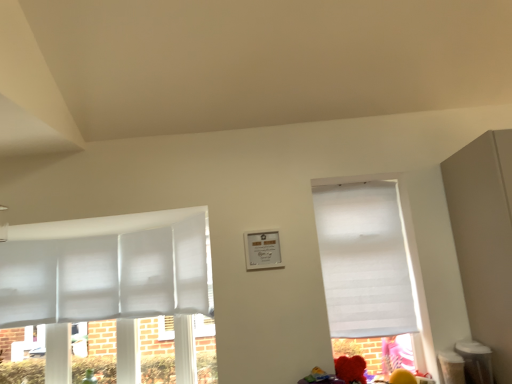
Question: Should I look upward or downward to see fluffy red teddy bear at lower right?

Choices:
 (A) down
 (B) up

Answer: (A)

Question: Can you confirm if fluffy red teddy bear at lower right is bigger than white fabric window at right?

Choices:
 (A) yes
 (B) no

Answer: (B)

Question: Is fluffy red teddy bear at lower right positioned with its back to white fabric window at right?

Choices:
 (A) no
 (B) yes

Answer: (B)

Question: Would you say fluffy red teddy bear at lower right is outside white fabric window at right?

Choices:
 (A) no
 (B) yes

Answer: (B)

Question: From the image's perspective, is fluffy red teddy bear at lower right on white fabric window at right?

Choices:
 (A) no
 (B) yes

Answer: (A)

Question: Does fluffy red teddy bear at lower right come behind white fabric window at right?

Choices:
 (A) yes
 (B) no

Answer: (B)

Question: Can you confirm if fluffy red teddy bear at lower right is wider than white fabric window at right?

Choices:
 (A) yes
 (B) no

Answer: (A)

Question: Can you confirm if white fabric window at right is positioned to the left of fluffy red teddy bear at lower right?

Choices:
 (A) yes
 (B) no

Answer: (B)

Question: Does white fabric window at right turn towards fluffy red teddy bear at lower right?

Choices:
 (A) no
 (B) yes

Answer: (B)

Question: Is white fabric window at right turned away from fluffy red teddy bear at lower right?

Choices:
 (A) no
 (B) yes

Answer: (A)

Question: From the image's perspective, is white fabric window at right located beneath fluffy red teddy bear at lower right?

Choices:
 (A) no
 (B) yes

Answer: (A)

Question: Does white fabric window at right contain fluffy red teddy bear at lower right?

Choices:
 (A) no
 (B) yes

Answer: (A)

Question: Considering the relative sizes of white fabric window at right and fluffy red teddy bear at lower right in the image provided, is white fabric window at right shorter than fluffy red teddy bear at lower right?

Choices:
 (A) yes
 (B) no

Answer: (B)

Question: Relative to fluffy red teddy bear at lower right, is white fabric window at right in front or behind?

Choices:
 (A) behind
 (B) front

Answer: (A)